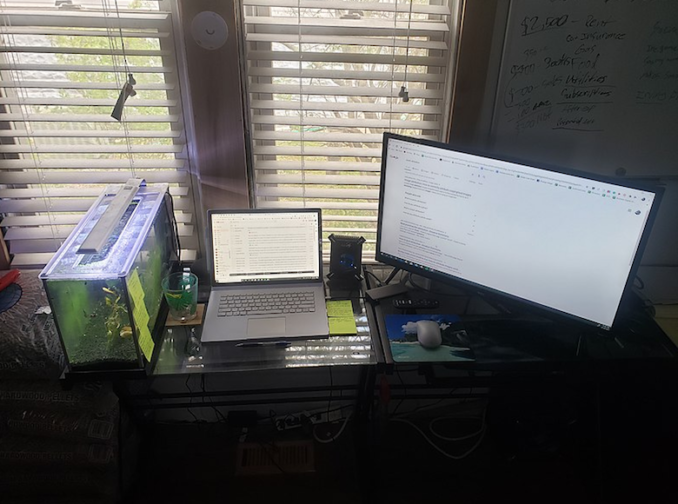
Where is `mouse`? The width and height of the screenshot is (678, 504). mouse is located at coordinates (428, 338).